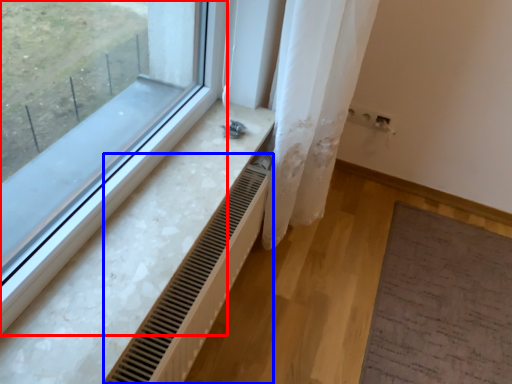
Question: Which of the following is the closest to the observer, window (highlighted by a red box) or radiator (highlighted by a blue box)?

Choices:
 (A) window
 (B) radiator

Answer: (A)